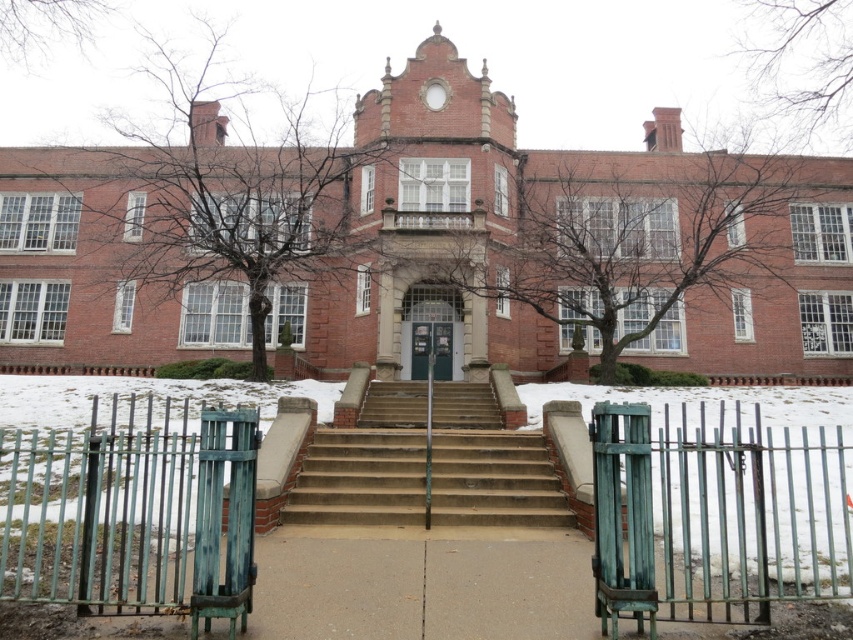
You are a visitor arriving at the building and want to reach the entrance. You see the green patina metal gate at lower left and the brown concrete stairs at center. Which object should you approach first to reach the entrance?

You should approach the green patina metal gate at lower left first because it is in front of the brown concrete stairs at center, meaning you must pass through the gate before ascending the stairs.

You are standing at the base of the wide concrete steps leading to the large red brick building. You need to find the green patina metal gate at lower right. According to the image, where would you look to locate it?

The green patina metal gate at lower right is located at point (714, 516), so you should look towards the lower right area near those coordinates to find it.